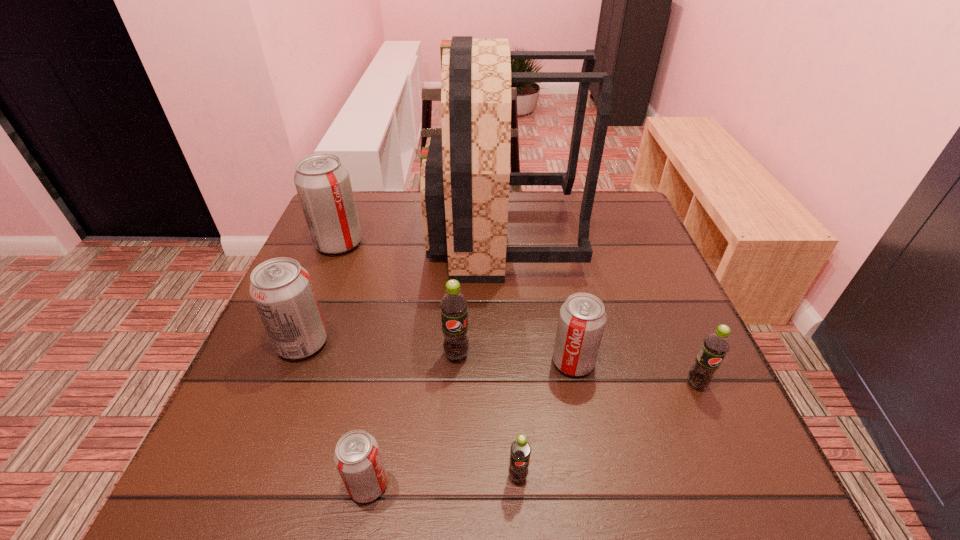
This screenshot has height=540, width=960. Find the location of `vacant space located 0.190m on the right of the rightmost gray soda can`. vacant space located 0.190m on the right of the rightmost gray soda can is located at coordinates (690, 362).

What are the coordinates of `vacant space located 0.200m on the front label of the rightmost green soda` in the screenshot? It's located at (750, 505).

Where is `vacant space positioned 0.260m on the back of the third soda can from left to right`? The height and width of the screenshot is (540, 960). vacant space positioned 0.260m on the back of the third soda can from left to right is located at coordinates (395, 343).

I want to click on backpack at the far edge, so point(465,173).

This screenshot has height=540, width=960. I want to click on soda can situated at the far edge, so 322,182.

Where is `object that is at the right edge`? object that is at the right edge is located at coordinates (715, 346).

Locate an element on the screen. The image size is (960, 540). object that is at the far left corner is located at coordinates (322, 182).

The image size is (960, 540). Identify the location of vacant space at the far edge. (543, 219).

Locate an element on the screen. The height and width of the screenshot is (540, 960). vacant region at the left edge of the desktop is located at coordinates (312, 281).

Where is `blank area at the right edge`? Image resolution: width=960 pixels, height=540 pixels. blank area at the right edge is located at coordinates (646, 283).